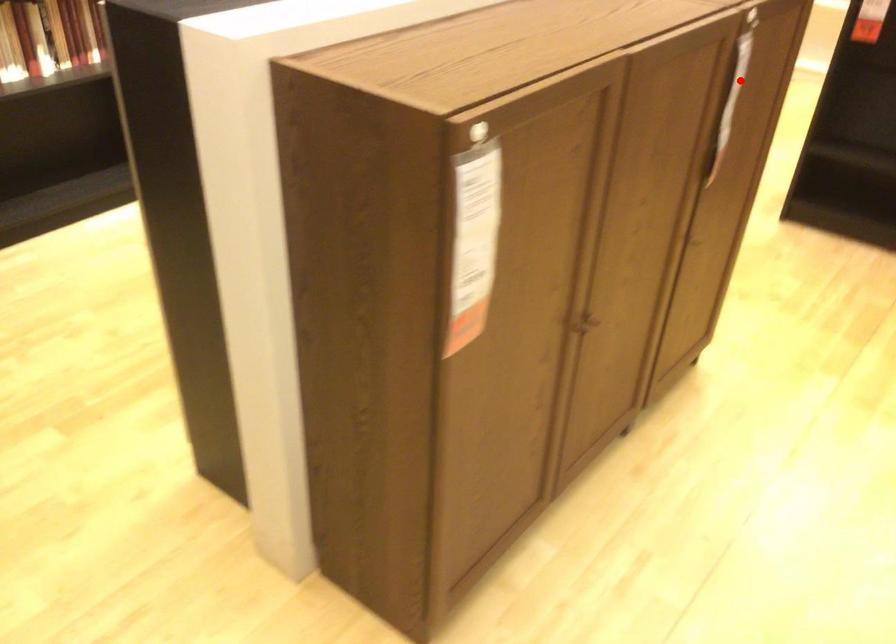
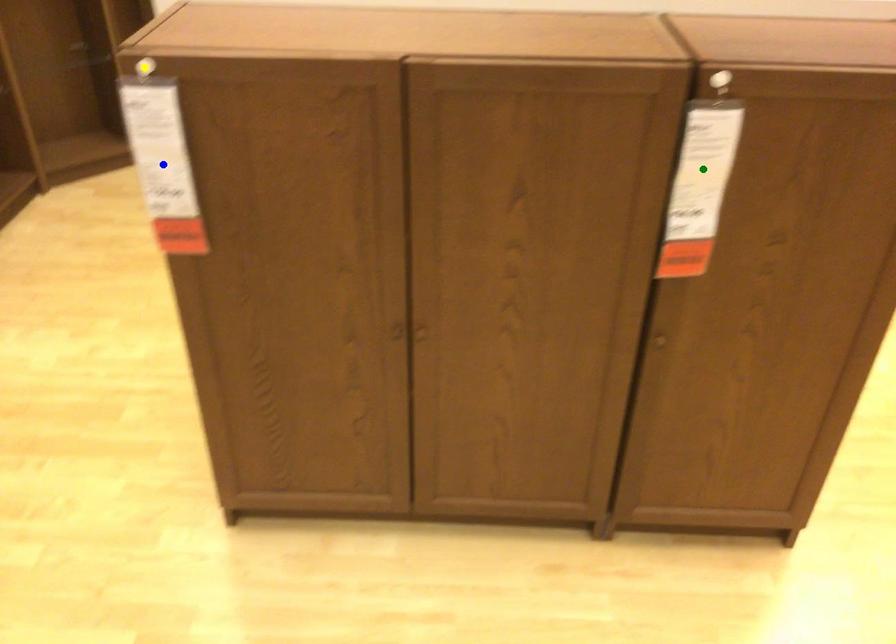
Question: I am providing you with two images of the same scene from different viewpoints. A red point is marked on the first image. You are given multiple points on the second image. In image 2, which mark is for the same physical point as the one in image 1?

Choices:
 (A) green point
 (B) blue point
 (C) yellow point

Answer: (A)